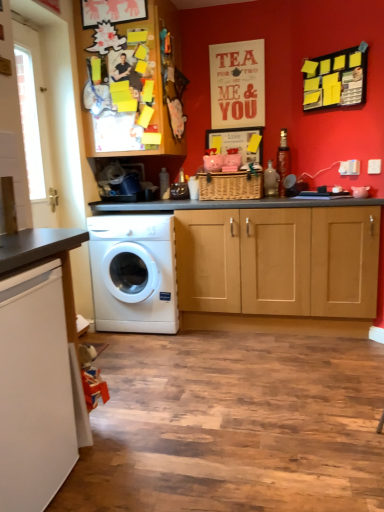
This screenshot has width=384, height=512. Identify the location of vacant space in front of white glossy washing machine at center. click(145, 352).